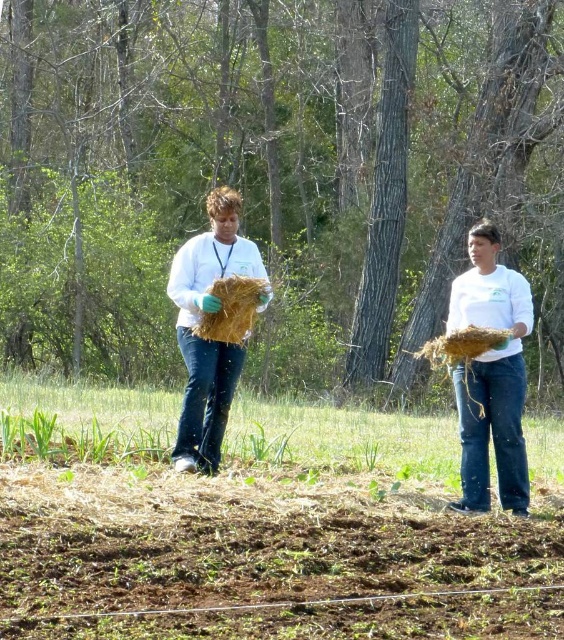
Question: Based on their relative distances, which object is nearer to the brown soil at lower center?

Choices:
 (A) white matte shirt at center
 (B) brown straw at center
 (C) matte straw bundle at center

Answer: (B)

Question: Estimate the real-world distances between objects in this image. Which object is farther from the matte straw bundle at center?

Choices:
 (A) brown soil at lower center
 (B) brown straw at center

Answer: (A)

Question: Which of these objects is positioned closest to the brown soil at lower center?

Choices:
 (A) brown straw at center
 (B) matte straw bundle at center
 (C) white matte shirt at center

Answer: (A)

Question: Can you confirm if brown soil at lower center is bigger than matte straw bundle at center?

Choices:
 (A) no
 (B) yes

Answer: (B)

Question: Is brown soil at lower center bigger than matte straw bundle at center?

Choices:
 (A) no
 (B) yes

Answer: (B)

Question: Does matte straw bundle at center appear on the right side of brown straw at center?

Choices:
 (A) yes
 (B) no

Answer: (B)